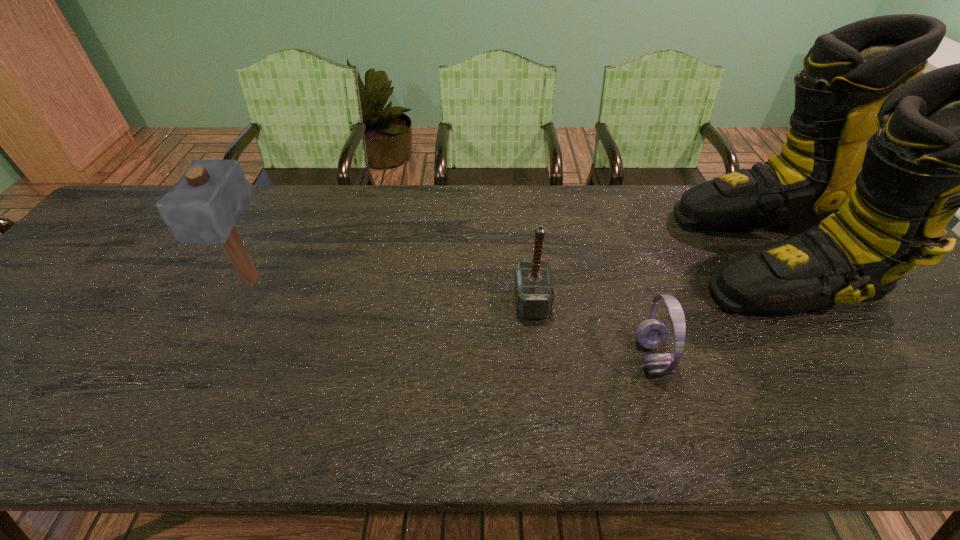
Find the location of a particular element. This screenshot has width=960, height=540. empty space between the ski boots and the shortest object is located at coordinates (712, 306).

Where is `free space between the rightmost object and the leftmost object`? The width and height of the screenshot is (960, 540). free space between the rightmost object and the leftmost object is located at coordinates (512, 267).

I want to click on unoccupied position between the mallet and the rightmost object, so click(512, 267).

Identify the location of free space that is in between the third tallest object and the second tallest object. Image resolution: width=960 pixels, height=540 pixels. (391, 291).

You are a GUI agent. You are given a task and a screenshot of the screen. Output one action in this format:
    pyautogui.click(x=<x>, y=<y>)
    Task: Click on the empty space between the mallet and the hammer
    
    Given the screenshot: What is the action you would take?
    pyautogui.click(x=391, y=291)

The height and width of the screenshot is (540, 960). I want to click on vacant area that lies between the shortest object and the second tallest object, so click(451, 319).

You are a GUI agent. You are given a task and a screenshot of the screen. Output one action in this format:
    pyautogui.click(x=<x>, y=<y>)
    Task: Click on the free space between the second object from left to right and the third object from left to right
    The height and width of the screenshot is (540, 960).
    Given the screenshot: What is the action you would take?
    pyautogui.click(x=591, y=329)

The image size is (960, 540). What are the coordinates of `vacant region between the third tallest object and the leftmost object` in the screenshot? It's located at (391, 291).

Where is `empty space that is in between the second object from left to right and the tallest object`? The image size is (960, 540). empty space that is in between the second object from left to right and the tallest object is located at coordinates (652, 278).

This screenshot has width=960, height=540. In order to click on vacant area that lies between the rightmost object and the hammer in this screenshot , I will do `click(652, 278)`.